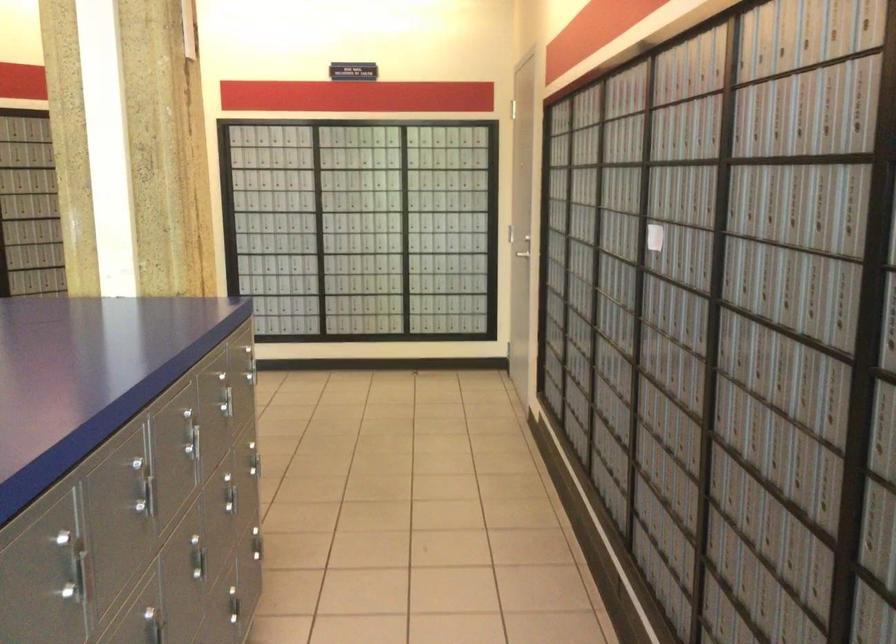
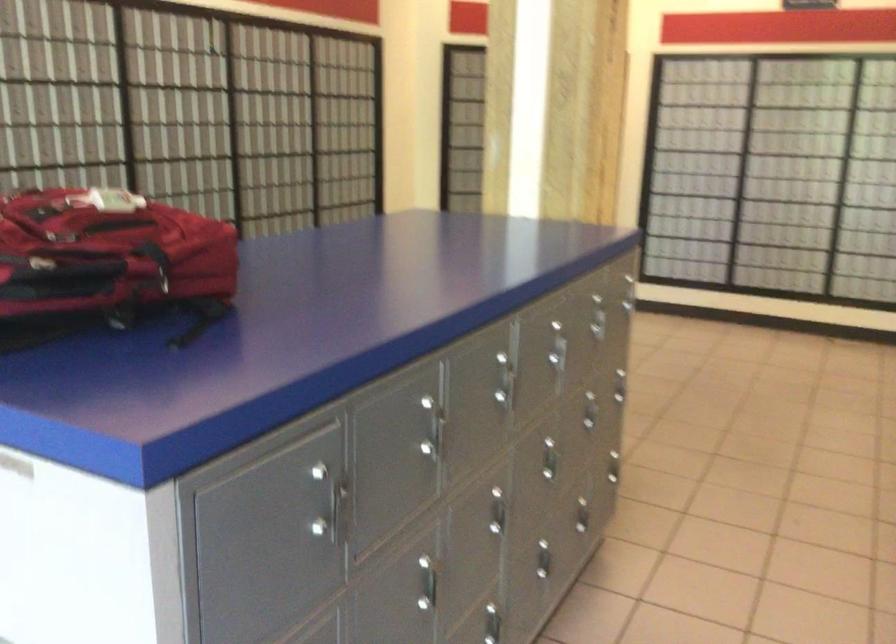
Question: How did the camera likely rotate?

Choices:
 (A) Left
 (B) Right
 (C) Up
 (D) Down

Answer: (A)